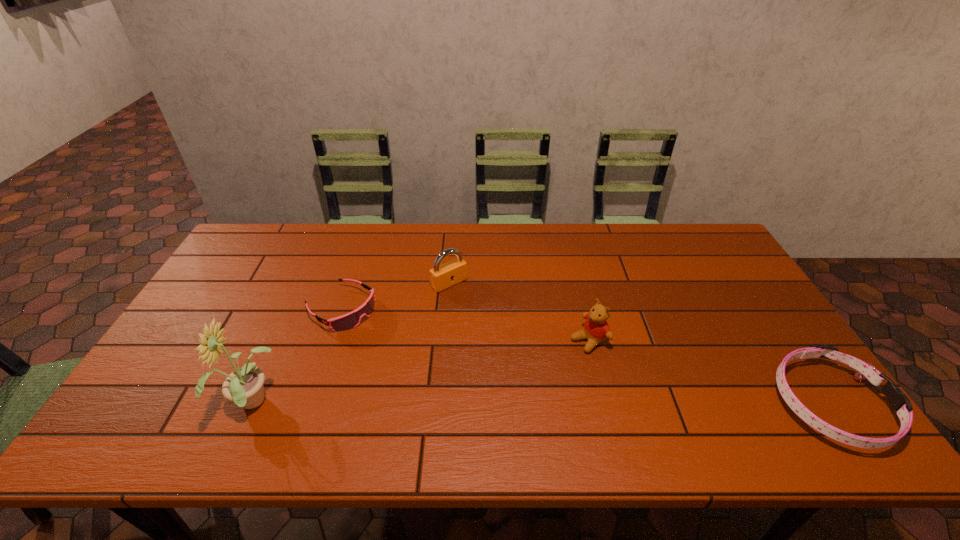
At what (x,y) coordinates should I click in order to perform the action: click on the tallest object. Please return your answer as a coordinate pair (x, y). The height and width of the screenshot is (540, 960). Looking at the image, I should click on [244, 386].

You are a GUI agent. You are given a task and a screenshot of the screen. Output one action in this format:
    pyautogui.click(x=<x>, y=<y>)
    Task: Click on the dog collar
    
    Given the screenshot: What is the action you would take?
    pyautogui.click(x=900, y=403)

Locate an element on the screen. The image size is (960, 540). goggles is located at coordinates (350, 320).

Find the location of `the third object from left to right`. the third object from left to right is located at coordinates (443, 276).

In order to click on the fourth object from left to right in this screenshot , I will do `click(596, 329)`.

Find the location of `vacant position located 0.210m on the front-facing side of the tallest object`. vacant position located 0.210m on the front-facing side of the tallest object is located at coordinates (140, 404).

Locate an element on the screen. free region located on the front-facing side of the tallest object is located at coordinates (136, 404).

The height and width of the screenshot is (540, 960). Find the location of `vacant space located on the front-facing side of the tallest object`. vacant space located on the front-facing side of the tallest object is located at coordinates (136, 404).

Find the location of a particular element. This screenshot has width=960, height=540. blank space located 0.380m on the front-facing side of the goggles is located at coordinates 468,393.

Where is `vacant point located 0.070m on the front-facing side of the goggles`? The height and width of the screenshot is (540, 960). vacant point located 0.070m on the front-facing side of the goggles is located at coordinates (381, 334).